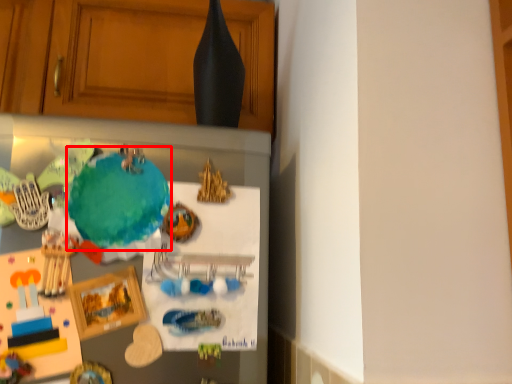
Question: In this image, where is teal (annotated by the red box) located relative to cabinetry?

Choices:
 (A) left
 (B) right

Answer: (B)